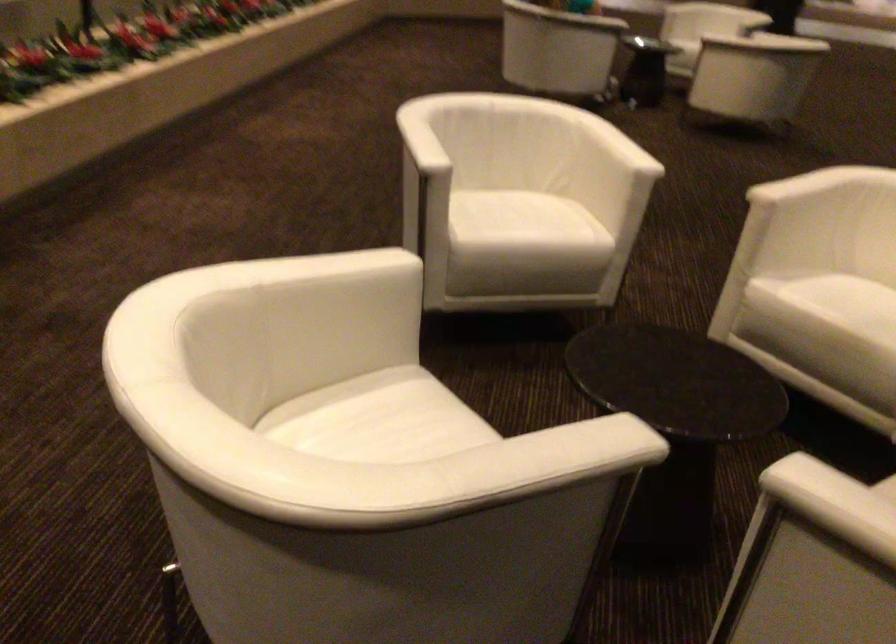
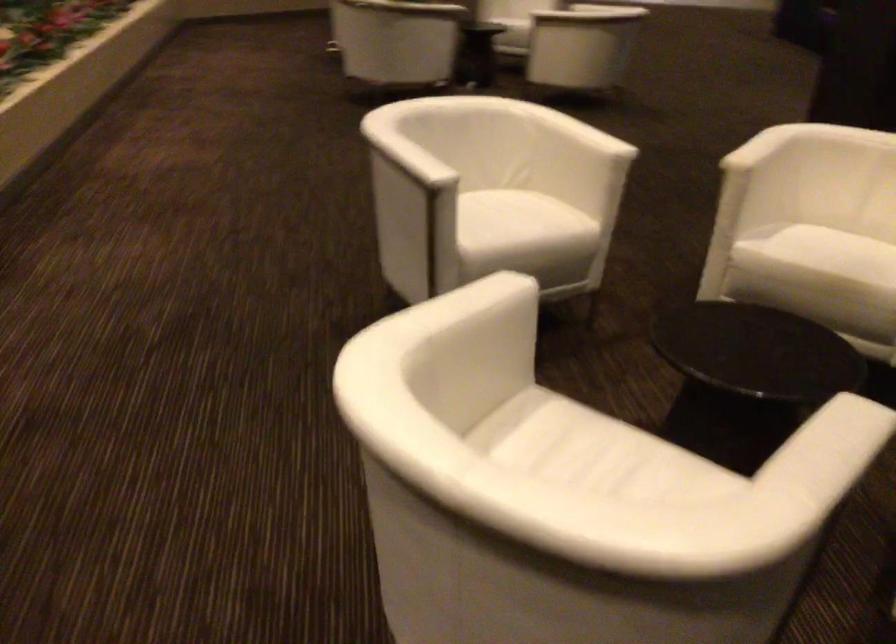
Question: Which direction would the cameraman need to move to produce the second image? Reply with the corresponding letter.

Choices:
 (A) Left
 (B) Right
 (C) Forward
 (D) Backward

Answer: (A)